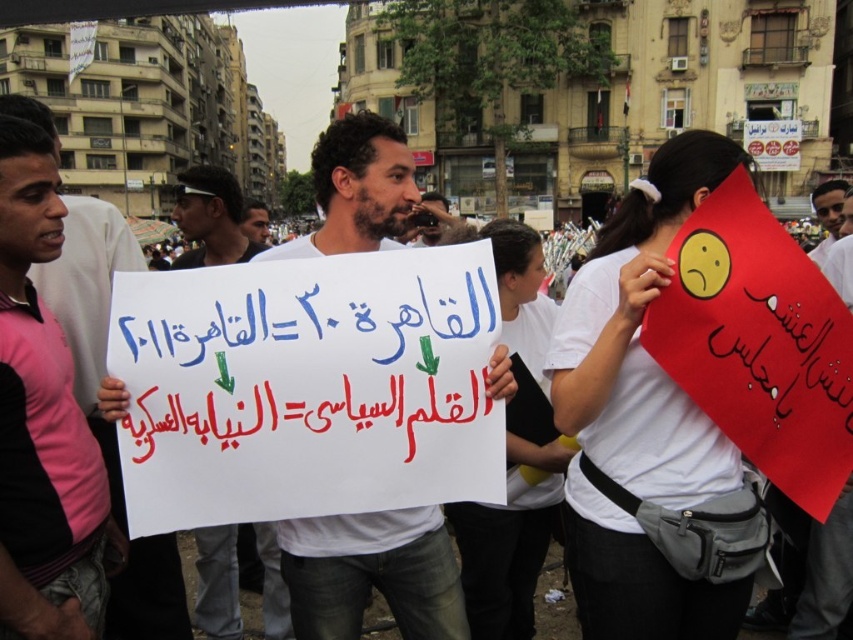
You are a photographer standing in the protest area. You notice a red paper sign at center and a matte white shirt at center. Which object is nearer to you?

The red paper sign at center is closer to the viewer than the matte white shirt at center.

Based on the protest scene described, which object among the white paper sign at center and the matte red sign at right is bigger in size?

The white paper sign at center is larger in size compared to the matte red sign at right.